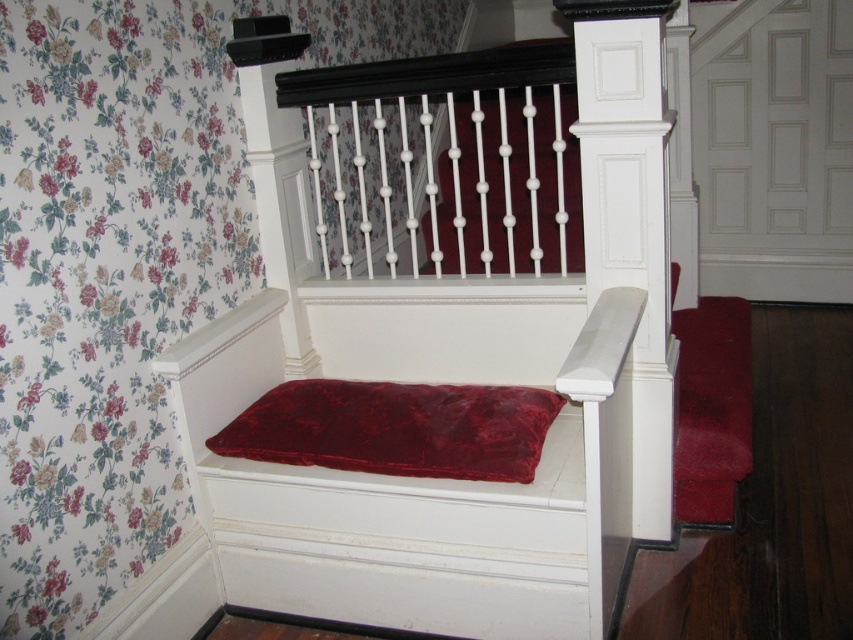
Does velvet cushion at center appear over velvet red pillow at center?

No, velvet cushion at center is not above velvet red pillow at center.

Between point (608, 596) and point (373, 438), which one is positioned behind?

The point (373, 438) is behind.

What are the coordinates of `velvet cushion at center` in the screenshot? It's located at (422, 477).